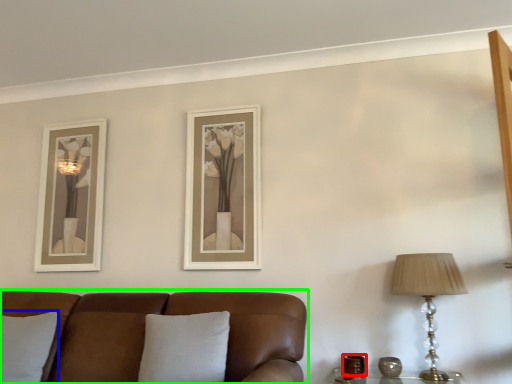
Question: Which is nearer to the candle holder (highlighted by a red box)? pillow (highlighted by a blue box) or studio couch (highlighted by a green box).

Choices:
 (A) pillow
 (B) studio couch

Answer: (B)